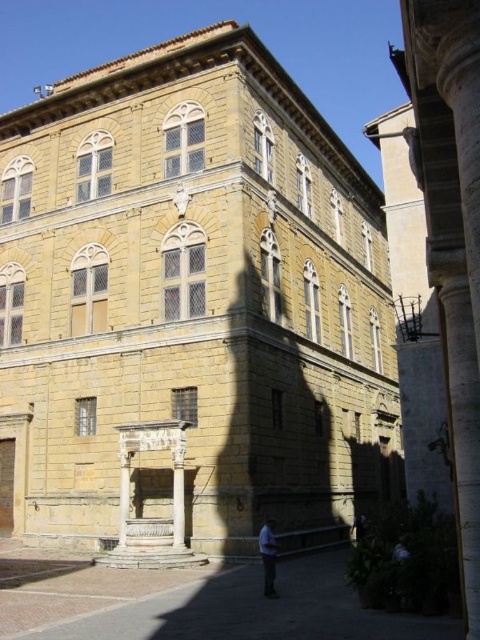
Question: Among these objects, which one is nearest to the camera?

Choices:
 (A) blue fabric shirt at lower center
 (B) smooth stone pillar at right

Answer: (B)

Question: Which of the following is the farthest from the observer?

Choices:
 (A) (436, 35)
 (B) (262, 528)

Answer: (B)

Question: Does smooth stone pillar at right appear on the right side of blue fabric shirt at lower center?

Choices:
 (A) yes
 (B) no

Answer: (A)

Question: Can you confirm if smooth stone pillar at right is smaller than blue fabric shirt at lower center?

Choices:
 (A) yes
 (B) no

Answer: (B)

Question: Can you confirm if smooth stone pillar at right is smaller than blue fabric shirt at lower center?

Choices:
 (A) no
 (B) yes

Answer: (A)

Question: Which object appears farthest from the camera in this image?

Choices:
 (A) blue fabric shirt at lower center
 (B) smooth stone pillar at right

Answer: (A)